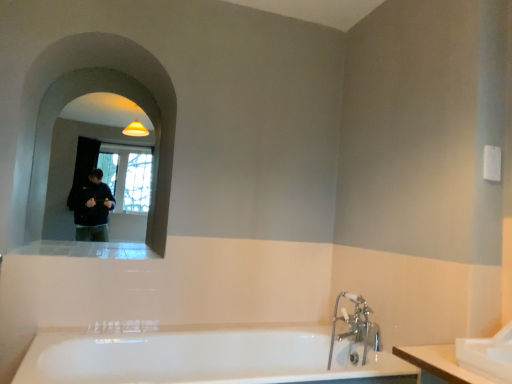
Locate an element on the screen. The height and width of the screenshot is (384, 512). white glossy sink at lower right is located at coordinates (487, 355).

Where is `chrome metallic faucet at lower right`? Image resolution: width=512 pixels, height=384 pixels. chrome metallic faucet at lower right is located at coordinates (356, 326).

Locate an element on the screen. This screenshot has width=512, height=384. white glossy sink at lower right is located at coordinates (487, 355).

Which is behind, matte glass mirror at upper left or white glossy sink at lower right?

matte glass mirror at upper left is more distant.

Is matte glass mirror at upper left in contact with white glossy sink at lower right?

There is a gap between matte glass mirror at upper left and white glossy sink at lower right.

From a real-world perspective, is matte glass mirror at upper left positioned above or below white glossy sink at lower right?

matte glass mirror at upper left is above white glossy sink at lower right.

In terms of height, does matte glass mirror at upper left look taller or shorter compared to white glossy sink at lower right?

Clearly, matte glass mirror at upper left is taller compared to white glossy sink at lower right.

Is white glossy sink at lower right not inside white glossy bathtub at lower center?

white glossy sink at lower right lies outside white glossy bathtub at lower center's area.

Which object is thinner, white glossy sink at lower right or white glossy bathtub at lower center?

white glossy sink at lower right is thinner.

Which object is positioned more to the left, white glossy sink at lower right or white glossy bathtub at lower center?

white glossy bathtub at lower center is more to the left.

Is point (469, 360) positioned behind point (411, 379)?

No, it is in front of (411, 379).

How many degrees apart are the facing directions of chrome metallic faucet at lower right and white glossy sink at lower right?

There is a 0.186-degree angle between the facing directions of chrome metallic faucet at lower right and white glossy sink at lower right.

Considering the positions of objects chrome metallic faucet at lower right and white glossy sink at lower right in the image provided, who is more to the left, chrome metallic faucet at lower right or white glossy sink at lower right?

chrome metallic faucet at lower right.

Consider the image. Is chrome metallic faucet at lower right aimed at white glossy sink at lower right?

No, chrome metallic faucet at lower right does not turn towards white glossy sink at lower right.

Looking at this image, from the image's perspective, is chrome metallic faucet at lower right above or below white glossy sink at lower right?

From the image's perspective, chrome metallic faucet at lower right appears below white glossy sink at lower right.

Is matte glass mirror at upper left facing away from chrome metallic faucet at lower right?

matte glass mirror at upper left is not turned away from chrome metallic faucet at lower right.

Which of these two, matte glass mirror at upper left or chrome metallic faucet at lower right, is bigger?

With larger size is matte glass mirror at upper left.

Is point (164, 242) in front of point (354, 322)?

No, (164, 242) is behind (354, 322).

Based on the photo, which object is more forward, matte glass mirror at upper left or chrome metallic faucet at lower right?

chrome metallic faucet at lower right is closer to the camera.

From a real-world perspective, is matte glass mirror at upper left below white glossy bathtub at lower center?

No, from a real-world perspective, matte glass mirror at upper left is not under white glossy bathtub at lower center.

Is matte glass mirror at upper left located outside white glossy bathtub at lower center?

Yes, matte glass mirror at upper left is located beyond the bounds of white glossy bathtub at lower center.

Between matte glass mirror at upper left and white glossy bathtub at lower center, which one has smaller width?

Thinner between the two is matte glass mirror at upper left.

How many degrees apart are the facing directions of matte glass mirror at upper left and white glossy bathtub at lower center?

0.202 degrees.

From the image's perspective, which is above, white glossy sink at lower right or matte glass mirror at upper left?

From the image's view, matte glass mirror at upper left is above.

Is the surface of white glossy sink at lower right in direct contact with matte glass mirror at upper left?

No.

Is point (506, 378) closer or farther from the camera than point (35, 185)?

Clearly, point (506, 378) is closer to the camera than point (35, 185).

In the scene shown: Is white glossy sink at lower right closer to the viewer compared to matte glass mirror at upper left?

Yes, it is in front of matte glass mirror at upper left.

Measure the distance between white glossy bathtub at lower center and chrome metallic faucet at lower right.

They are 38.47 centimeters apart.

Is white glossy bathtub at lower center positioned with its back to chrome metallic faucet at lower right?

No, chrome metallic faucet at lower right is not at the back of white glossy bathtub at lower center.

I want to click on tap behind the white glossy bathtub at lower center, so click(x=356, y=326).

Between white glossy bathtub at lower center and chrome metallic faucet at lower right, which one has less height?

white glossy bathtub at lower center.

The width and height of the screenshot is (512, 384). Identify the location of sink located below the matte glass mirror at upper left (from the image's perspective). (487, 355).

Find the location of `sink that is above the white glossy bathtub at lower center (from the image's perspective)`. sink that is above the white glossy bathtub at lower center (from the image's perspective) is located at coordinates (487, 355).

Consider the image. Estimate the real-world distances between objects in this image. Which object is further from matte glass mirror at upper left, white glossy sink at lower right or chrome metallic faucet at lower right?

Based on the image, white glossy sink at lower right appears to be further to matte glass mirror at upper left.

Considering their positions, is matte glass mirror at upper left positioned closer to white glossy bathtub at lower center than chrome metallic faucet at lower right?

chrome metallic faucet at lower right lies closer to white glossy bathtub at lower center than the other object.

When comparing their distances from white glossy sink at lower right, does chrome metallic faucet at lower right or matte glass mirror at upper left seem closer?

chrome metallic faucet at lower right is positioned closer to the anchor white glossy sink at lower right.

Consider the image. Based on their spatial positions, is white glossy bathtub at lower center or matte glass mirror at upper left closer to chrome metallic faucet at lower right?

white glossy bathtub at lower center is closer to chrome metallic faucet at lower right.

Estimate the real-world distances between objects in this image. Which object is further from chrome metallic faucet at lower right, white glossy bathtub at lower center or white glossy sink at lower right?

Among the two, white glossy sink at lower right is located further to chrome metallic faucet at lower right.

When comparing their distances from white glossy sink at lower right, does matte glass mirror at upper left or chrome metallic faucet at lower right seem further?

Based on the image, matte glass mirror at upper left appears to be further to white glossy sink at lower right.

From the image, which object appears to be nearer to white glossy bathtub at lower center, chrome metallic faucet at lower right or matte glass mirror at upper left?

Based on the image, chrome metallic faucet at lower right appears to be nearer to white glossy bathtub at lower center.

From the image, which object appears to be farther from matte glass mirror at upper left, chrome metallic faucet at lower right or white glossy bathtub at lower center?

chrome metallic faucet at lower right is further to matte glass mirror at upper left.

The height and width of the screenshot is (384, 512). What are the coordinates of `tap between white glossy bathtub at lower center and white glossy sink at lower right in the horizontal direction` in the screenshot? It's located at (356, 326).

You are a GUI agent. You are given a task and a screenshot of the screen. Output one action in this format:
    pyautogui.click(x=<x>, y=<y>)
    Task: Click on the bathtub between matte glass mirror at upper left and white glossy sink at lower right
    This screenshot has width=512, height=384.
    Given the screenshot: What is the action you would take?
    pyautogui.click(x=215, y=355)

You are a GUI agent. You are given a task and a screenshot of the screen. Output one action in this format:
    pyautogui.click(x=<x>, y=<y>)
    Task: Click on the bathtub between matte glass mirror at upper left and chrome metallic faucet at lower right
    The height and width of the screenshot is (384, 512).
    Given the screenshot: What is the action you would take?
    pyautogui.click(x=215, y=355)

In order to click on tap between matte glass mirror at upper left and white glossy sink at lower right in the horizontal direction in this screenshot , I will do `click(356, 326)`.